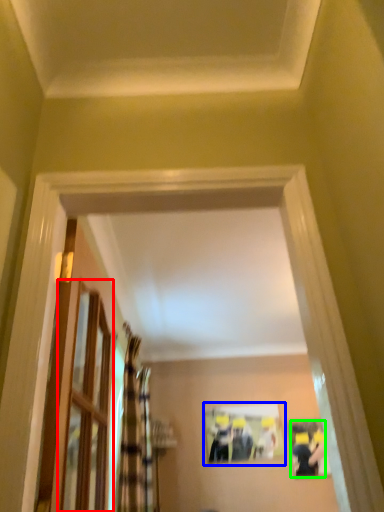
Question: Which object is positioned farthest from glass door (highlighted by a red box)? Select from picture frame (highlighted by a blue box) and couple (highlighted by a green box).

Choices:
 (A) picture frame
 (B) couple

Answer: (B)